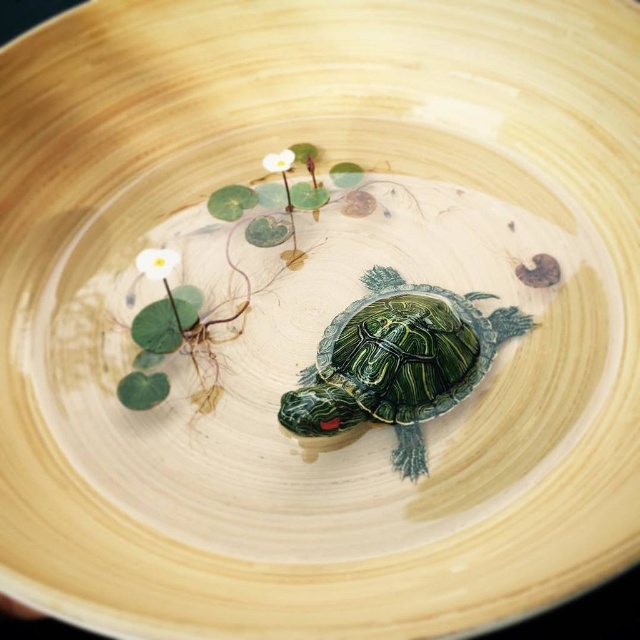
You are a small frog sitting on the edge of the wooden bowl. You want to jump to the white matte flower at upper left from the shiny green tortoise at center. Can you reach it in one jump if your maximum jump distance is 18 inches?

The distance between the shiny green tortoise at center and the white matte flower at upper left is 17.95 inches. Since your maximum jump distance is 18 inches, you can reach it in one jump.

You are a bee flying towards the white matte flower at upper left and the white matte flower at upper center in the miniature aquatic scene. Which flower should you head towards if you want to reach the one on the left first?

You should head towards the white matte flower at upper left because it is positioned to the left of the white matte flower at upper center.